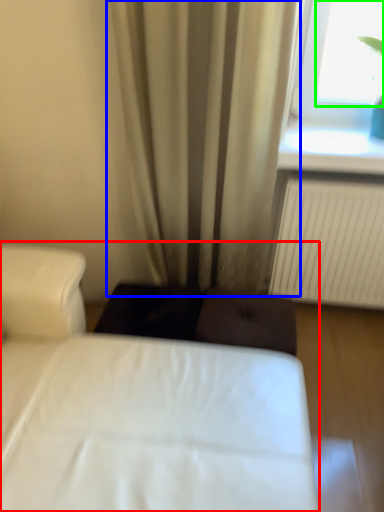
Question: Which is nearer to the bed (highlighted by a red box)? curtain (highlighted by a blue box) or window screen (highlighted by a green box).

Choices:
 (A) curtain
 (B) window screen

Answer: (A)